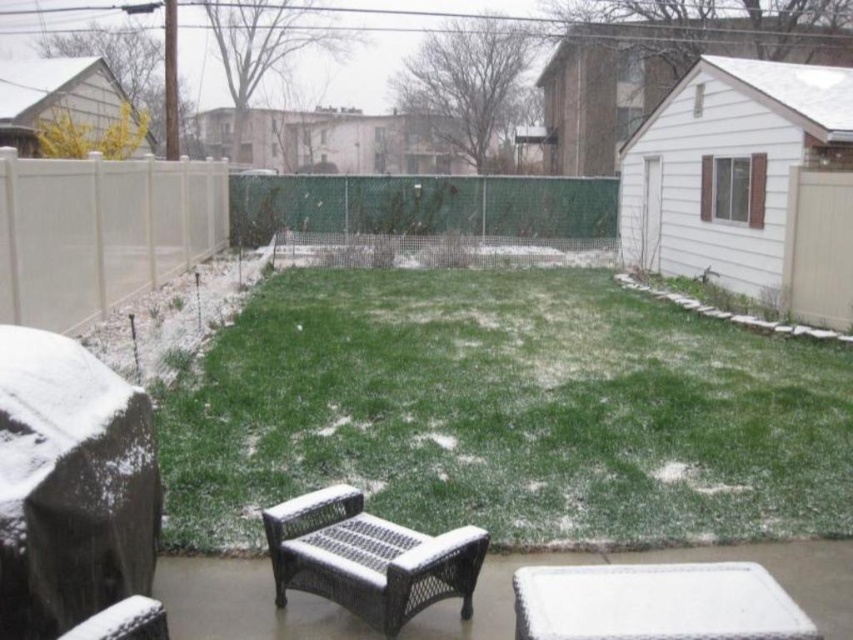
Consider the image. Between white vinyl fence at upper left and woven brown chair at lower center, which one has more height?

With more height is white vinyl fence at upper left.

Between point (24, 321) and point (331, 497), which one is positioned behind?

Point (24, 321)

The image size is (853, 640). Identify the location of white vinyl fence at upper left. (265, 225).

You are a GUI agent. You are given a task and a screenshot of the screen. Output one action in this format:
    pyautogui.click(x=<x>, y=<y>)
    Task: Click on the green grass at center
    
    Given the screenshot: What is the action you would take?
    pyautogui.click(x=506, y=412)

Does green grass at center have a lesser height compared to white vinyl fence at upper left?

Correct, green grass at center is not as tall as white vinyl fence at upper left.

This screenshot has height=640, width=853. I want to click on green grass at center, so click(x=506, y=412).

Can you confirm if green grass at center is positioned to the left of woven brown chair at lower center?

In fact, green grass at center is to the right of woven brown chair at lower center.

Is green grass at center to the right of woven brown chair at lower center from the viewer's perspective?

Indeed, green grass at center is positioned on the right side of woven brown chair at lower center.

Is point (364, 288) positioned before point (352, 538)?

No, it is not.

Where is `green grass at center`? The width and height of the screenshot is (853, 640). green grass at center is located at coordinates (506, 412).